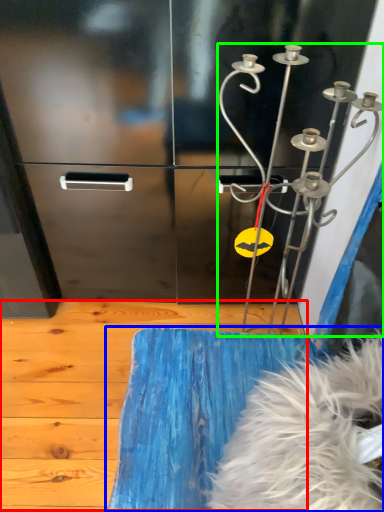
Question: Which object is positioned closest to plywood (highlighted by a red box)? Select from furniture (highlighted by a blue box) and wind chime (highlighted by a green box).

Choices:
 (A) furniture
 (B) wind chime

Answer: (A)